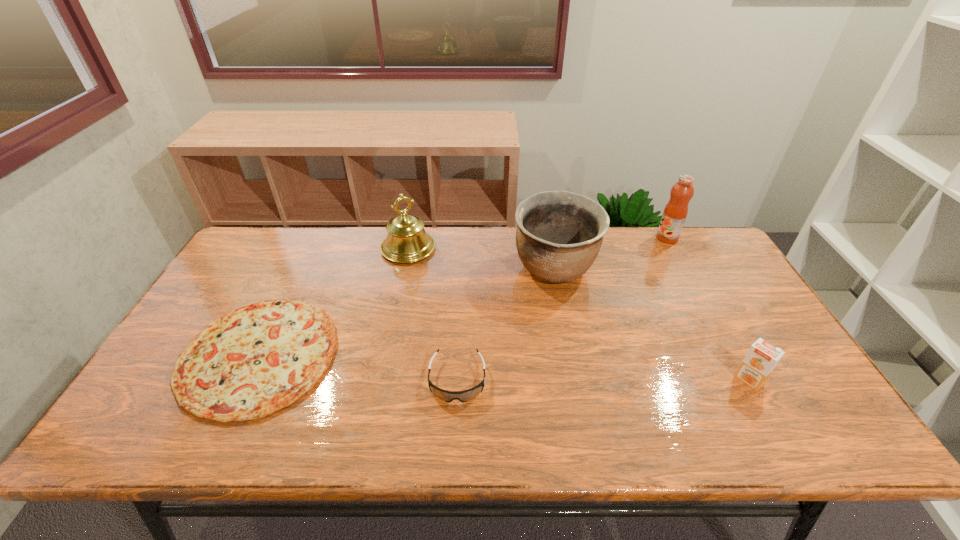
Find the location of a particular element. free space located on the front label of the fruit juice is located at coordinates (608, 238).

This screenshot has height=540, width=960. Identify the location of vacant space situated 0.060m on the back of the pottery. (548, 233).

Locate an element on the screen. The height and width of the screenshot is (540, 960). free point located on the front of the second object from left to right is located at coordinates (387, 354).

At what (x,y) coordinates should I click in order to perform the action: click on free region located 0.290m on the back of the orange juice. Please return your answer as a coordinate pair (x, y). Looking at the image, I should click on (700, 290).

Locate an element on the screen. free location located 0.200m on the back of the pizza is located at coordinates (305, 260).

Find the location of a particular element. This screenshot has width=960, height=540. fruit juice that is positioned at the far edge is located at coordinates (675, 212).

At what (x,y) coordinates should I click in order to perform the action: click on pottery that is positioned at the far edge. Please return your answer as a coordinate pair (x, y). Looking at the image, I should click on (x=559, y=234).

You are a GUI agent. You are given a task and a screenshot of the screen. Output one action in this format:
    pyautogui.click(x=<x>, y=<y>)
    Task: Click on the bell present at the far edge
    
    Given the screenshot: What is the action you would take?
    pyautogui.click(x=407, y=241)

Identify the location of object positioned at the near edge. This screenshot has height=540, width=960. (255, 360).

Identify the location of object situated at the left edge. (255, 360).